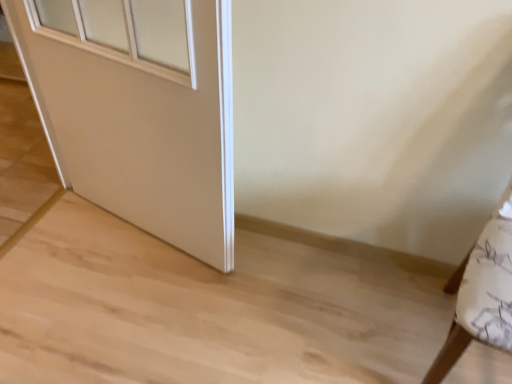
The height and width of the screenshot is (384, 512). I want to click on vacant region to the left of white fabric cushion at right, so click(x=343, y=323).